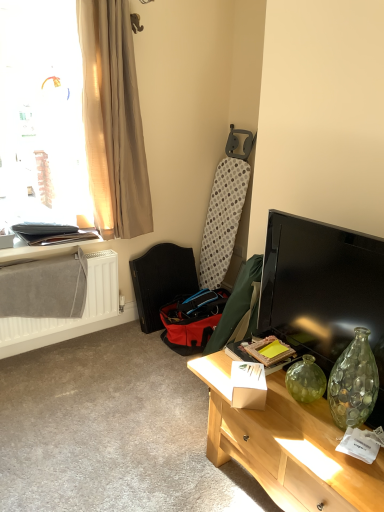
Identify the location of free location in front of white cardboard box at center. (281, 421).